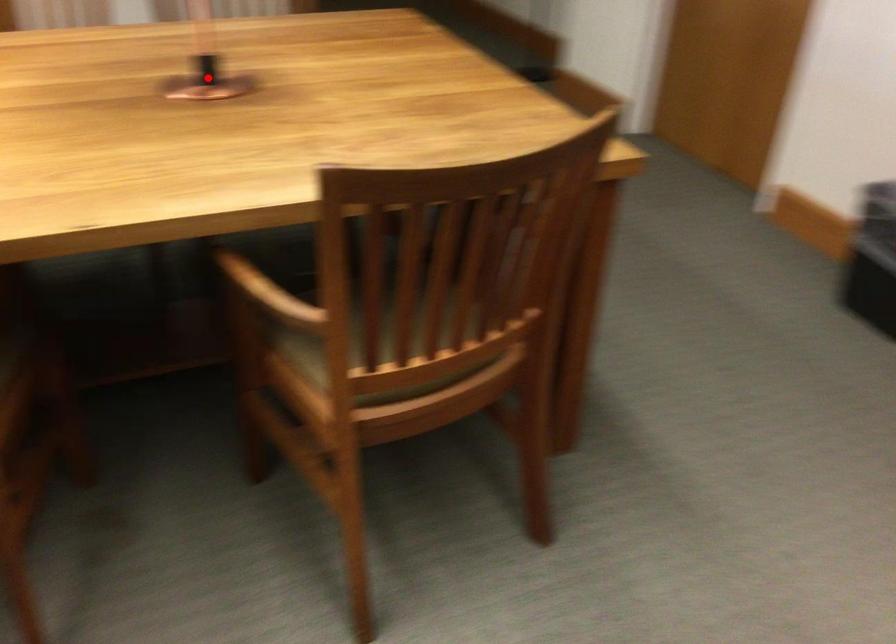
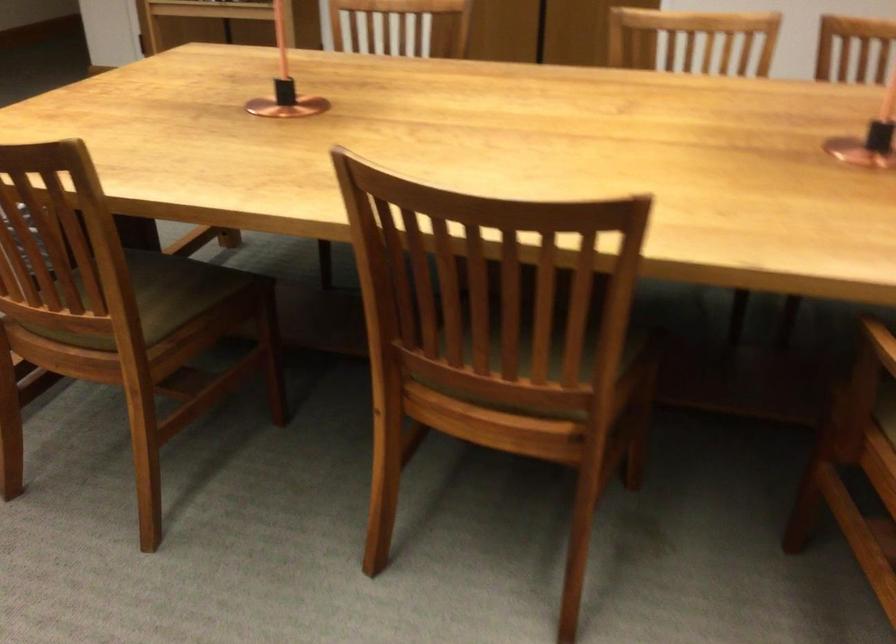
In the second image, find the point that corresponds to the highlighted location in the first image.

(869, 137)